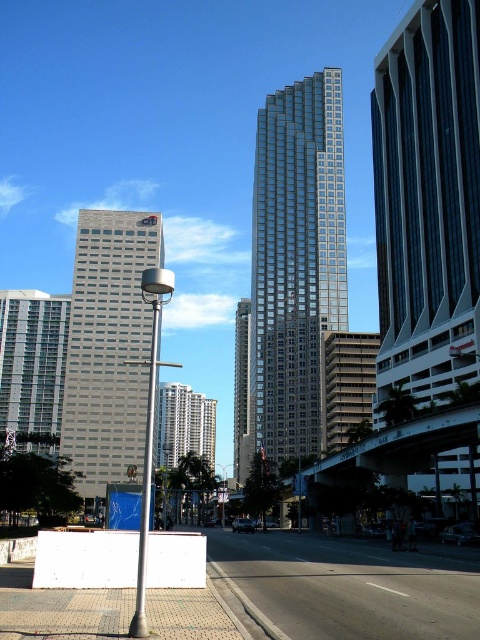
Is point (19, 326) positioned after point (136, 624)?

Yes, point (19, 326) is farther from viewer.

The image size is (480, 640). Find the location of `white glass building at left`. white glass building at left is located at coordinates (33, 368).

Does gray concrete building at center appear on the left side of silver metallic pole at left?

Correct, you'll find gray concrete building at center to the left of silver metallic pole at left.

Is gray concrete building at center shorter than silver metallic pole at left?

No.

Who is more distant from viewer, (98,272) or (148,493)?

Point (98,272)

I want to click on gray concrete building at center, so click(x=108, y=348).

Which of these two, silver metallic pole at left or glassy reflective skyscraper at center, stands shorter?

silver metallic pole at left

Does silver metallic pole at left have a lesser height compared to glassy reflective skyscraper at center?

Yes, silver metallic pole at left is shorter than glassy reflective skyscraper at center.

This screenshot has width=480, height=640. Describe the element at coordinates (146, 468) in the screenshot. I see `silver metallic pole at left` at that location.

Find the location of `silver metallic pole at left`. silver metallic pole at left is located at coordinates (146, 468).